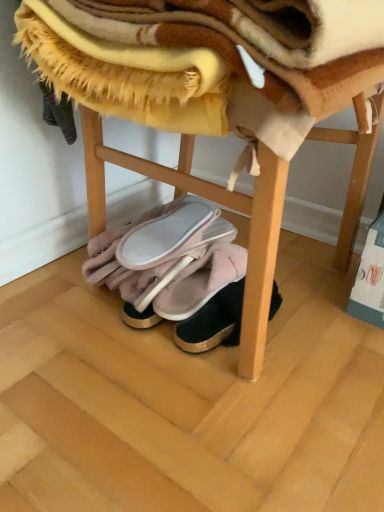
What are the coordinates of `wooden stool at lower center` in the screenshot? It's located at [x=171, y=131].

What do you see at coordinates (176, 272) in the screenshot? I see `pink fluffy slippers at lower center, the first footwear viewed from the left` at bounding box center [176, 272].

Locate an element on the screen. This screenshot has height=512, width=384. pink fluffy slippers at lower center, the fourth footwear positioned from the right is located at coordinates (176, 272).

This screenshot has width=384, height=512. I want to click on pink fuzzy slippers at center, arranged as the second footwear when viewed from the left, so point(167,234).

This screenshot has height=512, width=384. I want to click on wooden stool at lower center, so click(171, 131).

Considering the sizes of fuzzy yellow blanket at upper center and velvet pink slippers at center, which is counted as the 1th footwear, starting from the right, in the image, is fuzzy yellow blanket at upper center wider or thinner than velvet pink slippers at center, which is counted as the 1th footwear, starting from the right,?

Clearly, fuzzy yellow blanket at upper center has more width compared to velvet pink slippers at center, which is counted as the 1th footwear, starting from the right.

From a real-world perspective, relative to velvet pink slippers at center, arranged as the 4th footwear when viewed from the left, is fuzzy yellow blanket at upper center vertically above or below?

fuzzy yellow blanket at upper center is situated higher than velvet pink slippers at center, arranged as the 4th footwear when viewed from the left, in the real world.

Can we say fuzzy yellow blanket at upper center lies outside velvet pink slippers at center, arranged as the 4th footwear when viewed from the left?

That's correct, fuzzy yellow blanket at upper center is outside of velvet pink slippers at center, arranged as the 4th footwear when viewed from the left.

Could you tell me if fuzzy yellow blanket at upper center is turned towards velvet pink slippers at center, which is counted as the 1th footwear, starting from the right?

No, fuzzy yellow blanket at upper center does not turn towards velvet pink slippers at center, which is counted as the 1th footwear, starting from the right.

From the image's perspective, does wooden stool at lower center appear lower than pink fluffy slippers at lower center, the fourth footwear positioned from the right?

Incorrect, from the image's perspective, wooden stool at lower center is higher than pink fluffy slippers at lower center, the fourth footwear positioned from the right.

Does point (89, 198) appear closer or farther from the camera than point (127, 241)?

Point (89, 198) is positioned farther from the camera compared to point (127, 241).

Who is shorter, wooden stool at lower center or pink fluffy slippers at lower center, the fourth footwear positioned from the right?

Standing shorter between the two is pink fluffy slippers at lower center, the fourth footwear positioned from the right.

Based on the photo, from the image's perspective, which one is positioned lower, pink suede slippers at lower center, the 2th footwear when ordered from right to left, or fuzzy yellow blanket at upper center?

pink suede slippers at lower center, the 2th footwear when ordered from right to left, from the image's perspective.

Is pink suede slippers at lower center, acting as the 3th footwear starting from the left, directly adjacent to fuzzy yellow blanket at upper center?

No, pink suede slippers at lower center, acting as the 3th footwear starting from the left, is not beside fuzzy yellow blanket at upper center.

Is point (192, 268) closer or farther from the camera than point (361, 80)?

Point (192, 268) is positioned farther from the camera compared to point (361, 80).

Which footwear is the 2nd one when counting from the left side of the fuzzy yellow blanket at upper center? Please provide its 2D coordinates.

[(201, 281)]

From the image's perspective, which footwear is the 2nd one above the pink suede slippers at lower center, acting as the 3th footwear starting from the left? Please provide its 2D coordinates.

[(167, 234)]

Is pink fuzzy slippers at center, arranged as the second footwear when viewed from the left, not close to pink suede slippers at lower center, acting as the 3th footwear starting from the left?

No, pink fuzzy slippers at center, arranged as the second footwear when viewed from the left, is not far from pink suede slippers at lower center, acting as the 3th footwear starting from the left.

From a real-world perspective, is pink fuzzy slippers at center, arranged as the second footwear when viewed from the left, physically located above or below pink suede slippers at lower center, the 2th footwear when ordered from right to left?

Clearly, from a real-world perspective, pink fuzzy slippers at center, arranged as the second footwear when viewed from the left, is above pink suede slippers at lower center, the 2th footwear when ordered from right to left.

Looking at this image, can you confirm if pink fuzzy slippers at center, the third footwear viewed from the right, is smaller than pink suede slippers at lower center, the 2th footwear when ordered from right to left?

Yes, pink fuzzy slippers at center, the third footwear viewed from the right, is smaller than pink suede slippers at lower center, the 2th footwear when ordered from right to left.

Could you tell me if wooden stool at lower center is turned towards velvet pink slippers at center, arranged as the 4th footwear when viewed from the left?

No, wooden stool at lower center is not turned towards velvet pink slippers at center, arranged as the 4th footwear when viewed from the left.

From a real-world perspective, does wooden stool at lower center sit lower than velvet pink slippers at center, arranged as the 4th footwear when viewed from the left?

No, from a real-world perspective, wooden stool at lower center is not under velvet pink slippers at center, arranged as the 4th footwear when viewed from the left.

From the image's perspective, which one is positioned higher, wooden stool at lower center or velvet pink slippers at center, arranged as the 4th footwear when viewed from the left?

wooden stool at lower center.

Can you confirm if wooden stool at lower center is smaller than velvet pink slippers at center, arranged as the 4th footwear when viewed from the left?

Actually, wooden stool at lower center might be larger than velvet pink slippers at center, arranged as the 4th footwear when viewed from the left.

Is pink fluffy slippers at lower center, the fourth footwear positioned from the right, inside the boundaries of wooden stool at lower center, or outside?

pink fluffy slippers at lower center, the fourth footwear positioned from the right, can be found inside wooden stool at lower center.

Looking at this image, considering the sizes of pink fluffy slippers at lower center, the first footwear viewed from the left, and wooden stool at lower center in the image, is pink fluffy slippers at lower center, the first footwear viewed from the left, taller or shorter than wooden stool at lower center?

Considering their sizes, pink fluffy slippers at lower center, the first footwear viewed from the left, has less height than wooden stool at lower center.

Which is closer, (98, 241) or (84, 95)?

Clearly, point (98, 241) is more distant from the camera than point (84, 95).

Which object is positioned more to the right, pink fluffy slippers at lower center, the first footwear viewed from the left, or wooden stool at lower center?

From the viewer's perspective, wooden stool at lower center appears more on the right side.

From the image's perspective, relative to pink fuzzy slippers at center, the third footwear viewed from the right, is wooden stool at lower center above or below?

Based on their image positions, wooden stool at lower center is located above pink fuzzy slippers at center, the third footwear viewed from the right.

Which of these two, wooden stool at lower center or pink fuzzy slippers at center, arranged as the second footwear when viewed from the left, stands taller?

wooden stool at lower center is taller.

Considering the sizes of objects wooden stool at lower center and pink fuzzy slippers at center, arranged as the second footwear when viewed from the left, in the image provided, who is wider, wooden stool at lower center or pink fuzzy slippers at center, arranged as the second footwear when viewed from the left,?

wooden stool at lower center is wider.

Which footwear is the 1st one when counting from the left side of the fuzzy yellow blanket at upper center? Please provide its 2D coordinates.

[(213, 322)]

This screenshot has height=512, width=384. In order to click on the 2nd footwear positioned below the wooden stool at lower center (from the image's perspective) in this screenshot , I will do `click(176, 272)`.

Which object lies further to the anchor point velvet pink slippers at center, arranged as the 4th footwear when viewed from the left, wooden stool at lower center or fuzzy yellow blanket at upper center?

Based on the image, fuzzy yellow blanket at upper center appears to be further to velvet pink slippers at center, arranged as the 4th footwear when viewed from the left.

Looking at the image, which one is located closer to pink fuzzy slippers at center, arranged as the second footwear when viewed from the left, pink fluffy slippers at lower center, the fourth footwear positioned from the right, or pink suede slippers at lower center, the 2th footwear when ordered from right to left?

Based on the image, pink fluffy slippers at lower center, the fourth footwear positioned from the right, appears to be nearer to pink fuzzy slippers at center, arranged as the second footwear when viewed from the left.

Based on their spatial positions, is velvet pink slippers at center, arranged as the 4th footwear when viewed from the left, or wooden stool at lower center closer to pink suede slippers at lower center, acting as the 3th footwear starting from the left?

velvet pink slippers at center, arranged as the 4th footwear when viewed from the left.

Based on their spatial positions, is wooden stool at lower center or pink fuzzy slippers at center, arranged as the second footwear when viewed from the left, further from fuzzy yellow blanket at upper center?

pink fuzzy slippers at center, arranged as the second footwear when viewed from the left, is further to fuzzy yellow blanket at upper center.

When comparing their distances from pink fluffy slippers at lower center, the first footwear viewed from the left, does wooden stool at lower center or pink suede slippers at lower center, the 2th footwear when ordered from right to left, seem closer?

Among the two, pink suede slippers at lower center, the 2th footwear when ordered from right to left, is located nearer to pink fluffy slippers at lower center, the first footwear viewed from the left.

Considering their positions, is velvet pink slippers at center, arranged as the 4th footwear when viewed from the left, positioned further to wooden stool at lower center than pink fluffy slippers at lower center, the first footwear viewed from the left?

velvet pink slippers at center, arranged as the 4th footwear when viewed from the left, lies further to wooden stool at lower center than the other object.

When comparing their distances from fuzzy yellow blanket at upper center, does pink fluffy slippers at lower center, the fourth footwear positioned from the right, or wooden stool at lower center seem further?

pink fluffy slippers at lower center, the fourth footwear positioned from the right.

Looking at the image, which one is located further to pink fuzzy slippers at center, the third footwear viewed from the right, pink suede slippers at lower center, the 2th footwear when ordered from right to left, or velvet pink slippers at center, which is counted as the 1th footwear, starting from the right?

The object further to pink fuzzy slippers at center, the third footwear viewed from the right, is velvet pink slippers at center, which is counted as the 1th footwear, starting from the right.

Where is `footwear between pink fluffy slippers at lower center, the first footwear viewed from the left, and pink suede slippers at lower center, acting as the 3th footwear starting from the left, from left to right`? footwear between pink fluffy slippers at lower center, the first footwear viewed from the left, and pink suede slippers at lower center, acting as the 3th footwear starting from the left, from left to right is located at coordinates (167, 234).

Locate an element on the screen. blanket between wooden stool at lower center and pink fluffy slippers at lower center, the first footwear viewed from the left, along the z-axis is located at coordinates (179, 64).

Identify the location of footwear between wooden stool at lower center and pink suede slippers at lower center, acting as the 3th footwear starting from the left, from front to back. Image resolution: width=384 pixels, height=512 pixels. (213, 322).

Find the location of a particular element. blanket between wooden stool at lower center and pink suede slippers at lower center, the 2th footwear when ordered from right to left, in the front-back direction is located at coordinates (179, 64).